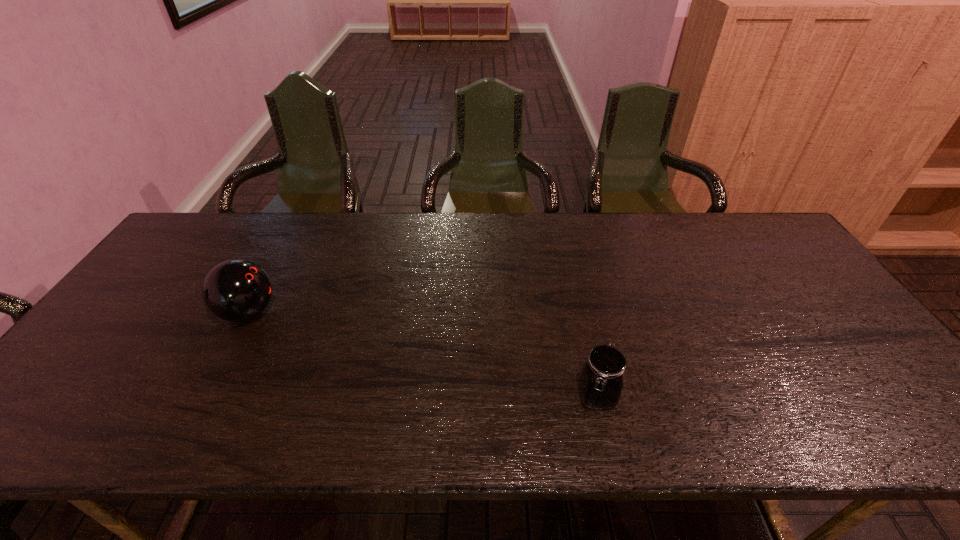
Find the location of a particular element. The height and width of the screenshot is (540, 960). the farther object is located at coordinates (235, 290).

You are a GUI agent. You are given a task and a screenshot of the screen. Output one action in this format:
    pyautogui.click(x=<x>, y=<y>)
    Task: Click on the bowling ball
    The height and width of the screenshot is (540, 960).
    Given the screenshot: What is the action you would take?
    pyautogui.click(x=235, y=290)

This screenshot has height=540, width=960. Find the location of `the shorter object`. the shorter object is located at coordinates (601, 384).

Find the location of `jar`. jar is located at coordinates (601, 384).

The width and height of the screenshot is (960, 540). Find the location of `vacant space located on the surface of the left object near the finger holes`. vacant space located on the surface of the left object near the finger holes is located at coordinates (312, 312).

Where is `vacant space located on the lid of the shorter object`? The height and width of the screenshot is (540, 960). vacant space located on the lid of the shorter object is located at coordinates (607, 442).

This screenshot has height=540, width=960. In order to click on object that is positioned at the near edge in this screenshot , I will do [601, 384].

Where is `vacant space at the far edge of the desktop`? This screenshot has height=540, width=960. vacant space at the far edge of the desktop is located at coordinates (688, 221).

Where is `blank space at the near edge of the desktop`? This screenshot has width=960, height=540. blank space at the near edge of the desktop is located at coordinates (600, 441).

You are a GUI agent. You are given a task and a screenshot of the screen. Output one action in this format:
    pyautogui.click(x=<x>, y=<y>)
    Task: Click on the blank space at the left edge
    The width and height of the screenshot is (960, 540).
    Given the screenshot: What is the action you would take?
    pyautogui.click(x=95, y=357)